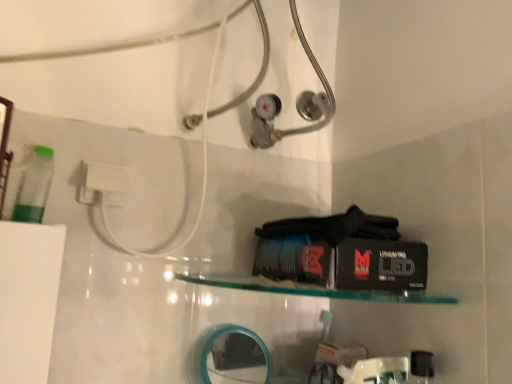
Question: In terms of size, does clear glass shelf at center appear bigger or smaller than white plastic plug at upper left?

Choices:
 (A) big
 (B) small

Answer: (A)

Question: From the image's perspective, relative to white plastic plug at upper left, is clear glass shelf at center above or below?

Choices:
 (A) below
 (B) above

Answer: (A)

Question: Which is nearer to the clear glass shelf at center?

Choices:
 (A) white plastic plug at upper left
 (B) teal plastic mirror at lower center

Answer: (B)

Question: Estimate the real-world distances between objects in this image. Which object is farther from the white plastic plug at upper left?

Choices:
 (A) teal plastic mirror at lower center
 (B) clear glass shelf at center

Answer: (A)